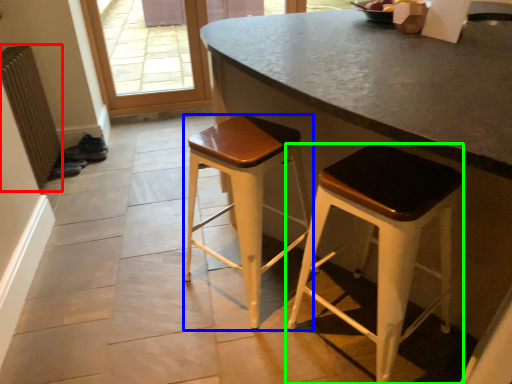
Question: Which object is the closest to the radiator (highlighted by a red box)? Choose among these: stool (highlighted by a blue box) or stool (highlighted by a green box).

Choices:
 (A) stool
 (B) stool

Answer: (A)